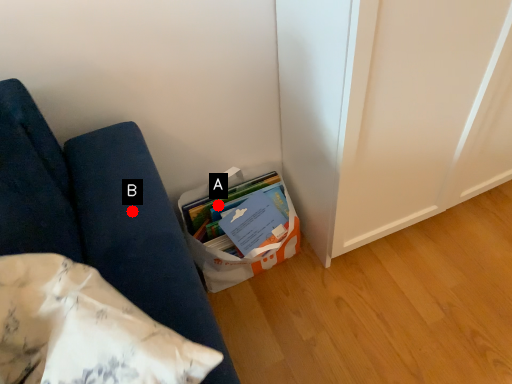
Question: Two points are circled on the image, labeled by A and B beside each circle. Among these points, which one is farthest from the camera?

Choices:
 (A) A is further
 (B) B is further

Answer: (A)